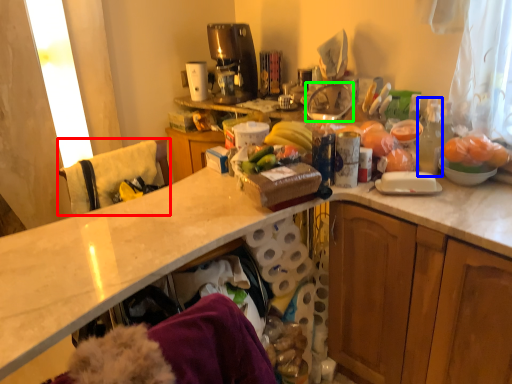
Question: Based on their relative distances, which object is farther from leftover (highlighted by a red box)? Choose from bottle (highlighted by a blue box) and appliance (highlighted by a green box).

Choices:
 (A) bottle
 (B) appliance

Answer: (A)